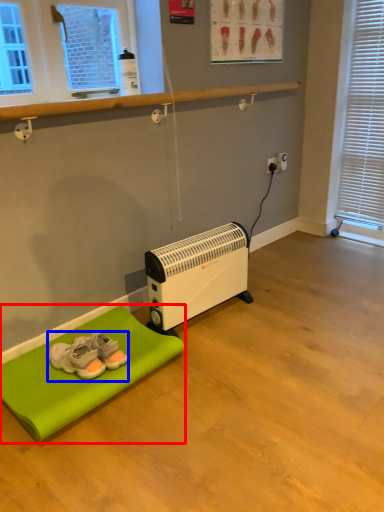
Question: Which object is further to the camera taking this photo, furniture (highlighted by a red box) or footwear (highlighted by a blue box)?

Choices:
 (A) furniture
 (B) footwear

Answer: (B)